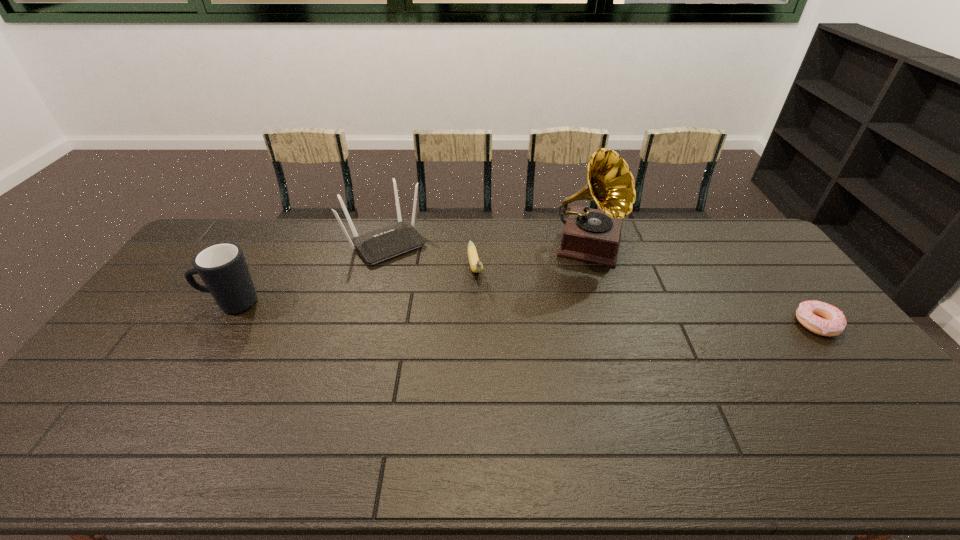
The width and height of the screenshot is (960, 540). In order to click on vacant space on the desktop that is between the mug and the rightmost object and is positioned at the stem of the banana in this screenshot , I will do `click(488, 312)`.

Identify the location of free space on the desktop that is between the mug and the shortest object and is positioned on the front-facing side of the second object from left to right. The height and width of the screenshot is (540, 960). (444, 310).

I want to click on vacant spot on the desktop that is between the mug and the rightmost object and is positioned from the horn of the tallest object, so click(572, 315).